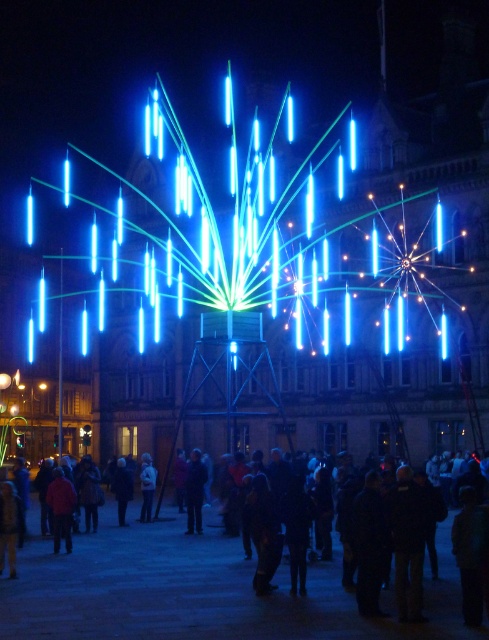
Can you confirm if blue glass tubes at center is taller than white matte jacket at center?

Yes, blue glass tubes at center is taller than white matte jacket at center.

You are a GUI agent. You are given a task and a screenshot of the screen. Output one action in this format:
    pyautogui.click(x=<x>, y=<y>)
    Task: Click on the blue glass tubes at center
    The image size is (489, 640).
    Given the screenshot: What is the action you would take?
    pyautogui.click(x=264, y=234)

Which of these two, dark blue fabric jacket at center or dark blue fabric coat at lower center, stands taller?

dark blue fabric jacket at center

Can you confirm if dark blue fabric jacket at center is smaller than dark blue fabric coat at lower center?

Actually, dark blue fabric jacket at center might be larger than dark blue fabric coat at lower center.

Between point (197, 451) and point (127, 477), which one is positioned behind?

The point (127, 477) is behind.

You are a GUI agent. You are given a task and a screenshot of the screen. Output one action in this format:
    pyautogui.click(x=<x>, y=<y>)
    Task: Click on the dark blue fabric jacket at center
    
    Given the screenshot: What is the action you would take?
    pyautogui.click(x=195, y=492)

Which is below, red fabric jacket at lower left or dark blue fabric coat at lower center?

red fabric jacket at lower left

Which of these two, red fabric jacket at lower left or dark blue fabric coat at lower center, stands taller?

dark blue fabric coat at lower center is taller.

Where is `red fabric jacket at lower left`? This screenshot has width=489, height=640. red fabric jacket at lower left is located at coordinates (61, 508).